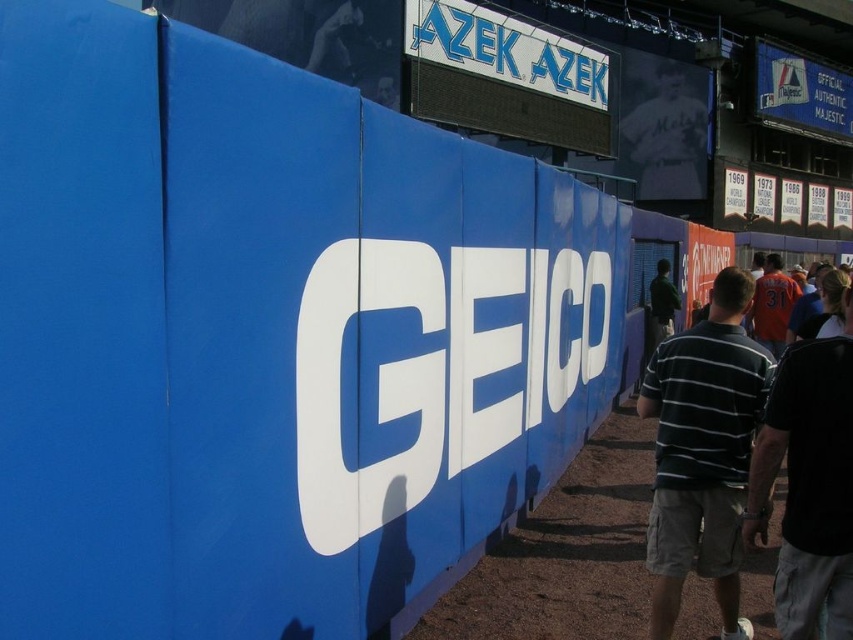
Question: Which point is farther from the camera taking this photo?

Choices:
 (A) (485, 32)
 (B) (775, 67)

Answer: (B)

Question: Is blue plastic sign at upper center below blue fabric sign at upper right?

Choices:
 (A) no
 (B) yes

Answer: (B)

Question: Which object is closer to the camera taking this photo?

Choices:
 (A) dark gray cotton shirt at right
 (B) blue fabric sign at upper right

Answer: (A)

Question: Can you confirm if dark gray cotton shirt at right is bigger than green matte shirt at center?

Choices:
 (A) no
 (B) yes

Answer: (B)

Question: Does dark gray cotton shirt at right appear over blue fabric sign at upper right?

Choices:
 (A) yes
 (B) no

Answer: (B)

Question: Which object appears farthest from the camera in this image?

Choices:
 (A) blue fabric sign at upper right
 (B) green matte shirt at center

Answer: (A)